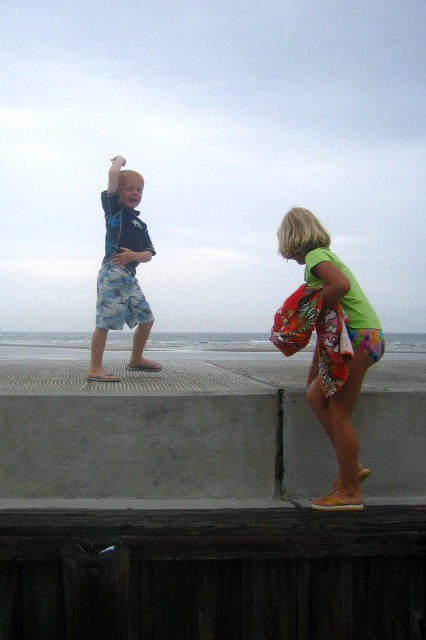
Between point (74, 369) and point (322, 392), which one is positioned behind?

The point (74, 369) is behind.

Who is lower down, gray concrete at lower center or floral shorts at center?

Positioned lower is gray concrete at lower center.

Is point (23, 493) behind point (325, 244)?

Yes, it is.

At what (x,y) coordinates should I click in order to perform the action: click on gray concrete at lower center. Please return your answer as a coordinate pair (x, y). This screenshot has height=640, width=426. Looking at the image, I should click on (161, 432).

Does gray concrete at lower center have a lesser width compared to blue camouflage shorts at left?

→ Incorrect, gray concrete at lower center's width is not less than blue camouflage shorts at left's.

Does gray concrete at lower center have a larger size compared to blue camouflage shorts at left?

Yes.

Measure the distance between point (201, 419) and camera.

The distance of point (201, 419) from camera is 14.21 feet.

Find the location of a particular element. The height and width of the screenshot is (640, 426). gray concrete at lower center is located at coordinates (161, 432).

Does point (330, 500) lie in front of point (114, 192)?

Yes, point (330, 500) is in front of point (114, 192).

Is point (344, 484) positioned in front of point (118, 284)?

That is True.

Locate an element on the screen. This screenshot has width=426, height=640. floral shorts at center is located at coordinates (319, 349).